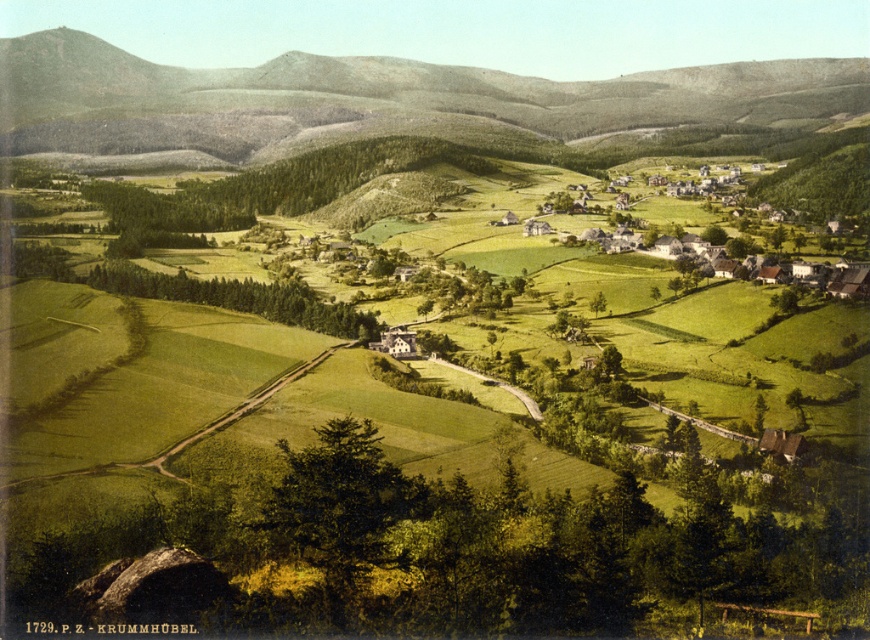
Question: Which object is closer to the camera taking this photo?

Choices:
 (A) green textured hillside at upper center
 (B) white thatched-roof houses at center-right

Answer: (B)

Question: Which of the following is the farthest from the observer?

Choices:
 (A) (777, 230)
 (B) (110, 145)

Answer: (B)

Question: Does green textured hillside at upper center come behind white thatched-roof houses at center-right?

Choices:
 (A) yes
 (B) no

Answer: (A)

Question: Can you confirm if green textured hillside at upper center is smaller than white thatched-roof houses at center-right?

Choices:
 (A) yes
 (B) no

Answer: (B)

Question: Which point is closer to the camera?

Choices:
 (A) green textured hillside at upper center
 (B) white thatched-roof houses at center-right

Answer: (B)

Question: Is green textured hillside at upper center thinner than white thatched-roof houses at center-right?

Choices:
 (A) yes
 (B) no

Answer: (B)